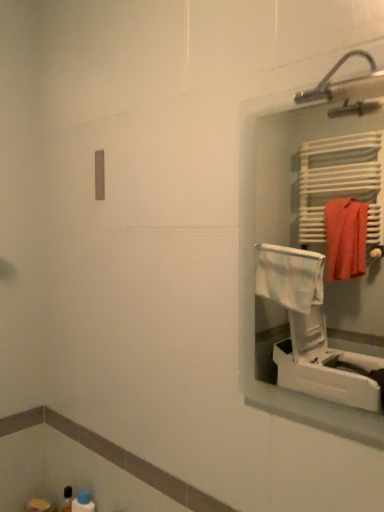
Question: Is white plastic medicine cabinet at right far from blue plastic bottle at lower left?

Choices:
 (A) no
 (B) yes

Answer: (B)

Question: Is white plastic medicine cabinet at right positioned in front of blue plastic bottle at lower left?

Choices:
 (A) yes
 (B) no

Answer: (A)

Question: Is the depth of white plastic medicine cabinet at right greater than that of blue plastic bottle at lower left?

Choices:
 (A) no
 (B) yes

Answer: (A)

Question: Does white plastic medicine cabinet at right appear on the left side of blue plastic bottle at lower left?

Choices:
 (A) yes
 (B) no

Answer: (B)

Question: Can you confirm if white plastic medicine cabinet at right is positioned to the right of blue plastic bottle at lower left?

Choices:
 (A) no
 (B) yes

Answer: (B)

Question: From a real-world perspective, is white plastic medicine cabinet at right positioned under blue plastic bottle at lower left based on gravity?

Choices:
 (A) yes
 (B) no

Answer: (B)

Question: Is blue plastic bottle at lower left behind white plastic medicine cabinet at right?

Choices:
 (A) yes
 (B) no

Answer: (A)

Question: Considering the relative sizes of blue plastic bottle at lower left and white plastic medicine cabinet at right in the image provided, is blue plastic bottle at lower left shorter than white plastic medicine cabinet at right?

Choices:
 (A) no
 (B) yes

Answer: (B)

Question: Is blue plastic bottle at lower left oriented away from white plastic medicine cabinet at right?

Choices:
 (A) no
 (B) yes

Answer: (A)

Question: Does blue plastic bottle at lower left appear on the left side of white plastic medicine cabinet at right?

Choices:
 (A) yes
 (B) no

Answer: (A)

Question: Is the depth of blue plastic bottle at lower left less than that of white plastic medicine cabinet at right?

Choices:
 (A) no
 (B) yes

Answer: (A)

Question: Does blue plastic bottle at lower left have a greater height compared to white plastic medicine cabinet at right?

Choices:
 (A) yes
 (B) no

Answer: (B)

Question: Does point (324, 152) appear closer or farther from the camera than point (77, 496)?

Choices:
 (A) closer
 (B) farther

Answer: (B)